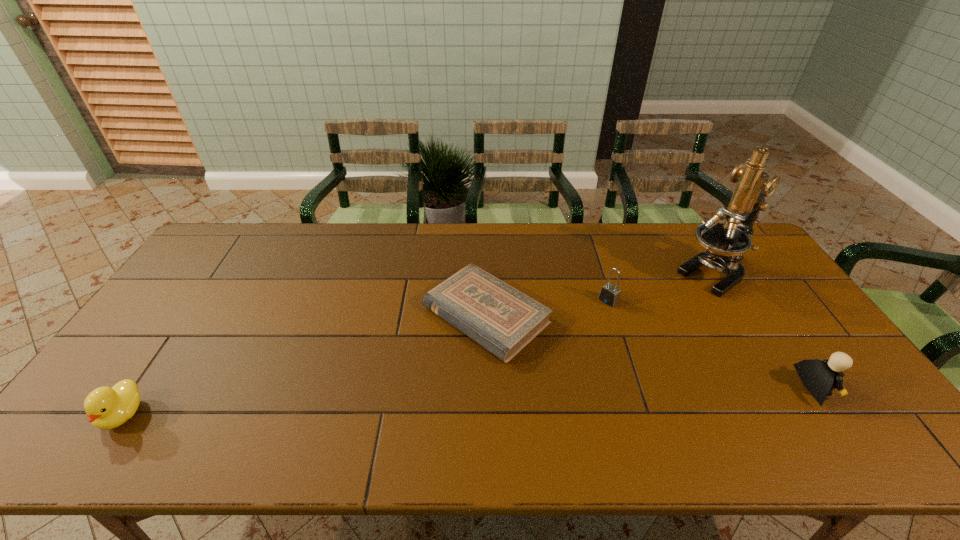
The height and width of the screenshot is (540, 960). In order to click on free space at the far right corner in this screenshot , I will do `click(754, 251)`.

I want to click on empty location between the microscope and the Lego, so click(766, 331).

The image size is (960, 540). I want to click on empty space between the fourth tallest object and the microscope, so click(x=420, y=344).

Find the location of a particular element. The height and width of the screenshot is (540, 960). vacant area that lies between the tallest object and the Lego is located at coordinates (766, 331).

Image resolution: width=960 pixels, height=540 pixels. I want to click on vacant space in between the tallest object and the leftmost object, so click(x=420, y=344).

Find the location of `unoccupied area between the third object from left to right and the leftmost object`. unoccupied area between the third object from left to right and the leftmost object is located at coordinates (366, 357).

At what (x,y) coordinates should I click in order to perform the action: click on vacant space in between the duckling and the Bible. Please return your answer as a coordinate pair (x, y). The height and width of the screenshot is (540, 960). Looking at the image, I should click on (304, 364).

You are a GUI agent. You are given a task and a screenshot of the screen. Output one action in this format:
    pyautogui.click(x=<x>, y=<y>)
    Task: Click on the free spot between the third object from left to right and the Lego
    Image resolution: width=960 pixels, height=540 pixels.
    Given the screenshot: What is the action you would take?
    pyautogui.click(x=712, y=345)

Locate an element on the screen. Image resolution: width=960 pixels, height=540 pixels. empty space that is in between the Lego and the second shortest object is located at coordinates (469, 401).

Choose which object is the fourth nearest neighbor to the Lego. Please provide its 2D coordinates. Your answer should be formatted as a tuple, i.e. [(x, y)], where the tuple contains the x and y coordinates of a point satisfying the conditions above.

[(106, 408)]